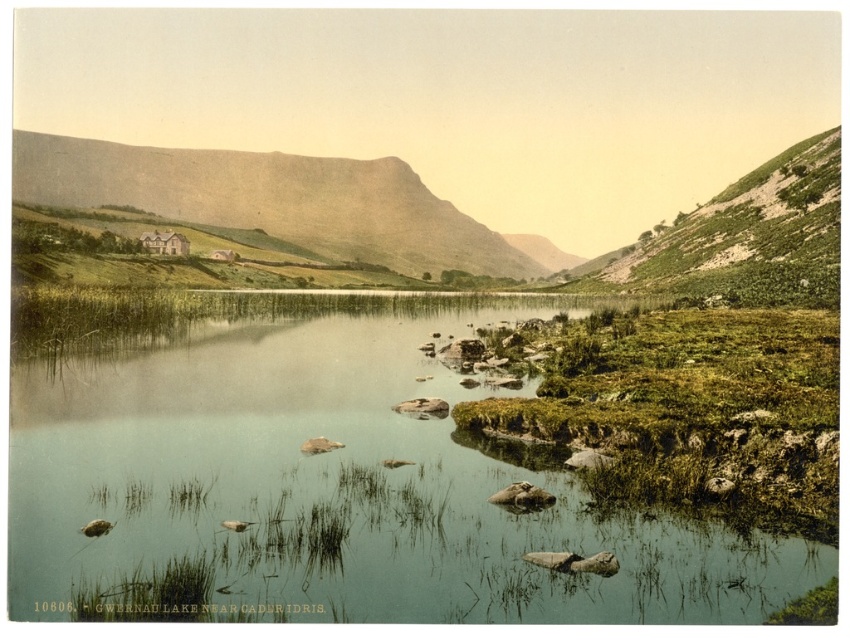
Question: Which of the following is the farthest from the observer?

Choices:
 (A) (673, 541)
 (B) (173, 177)

Answer: (B)

Question: Which of the following is the closest to the observer?

Choices:
 (A) green grassy river at center
 (B) smooth beige mountain at center

Answer: (A)

Question: Is green grassy river at center bigger than smooth beige mountain at center?

Choices:
 (A) no
 (B) yes

Answer: (A)

Question: In this image, where is green grassy river at center located relative to smooth beige mountain at center?

Choices:
 (A) left
 (B) right

Answer: (B)

Question: Which of the following is the farthest from the observer?

Choices:
 (A) (545, 241)
 (B) (309, 401)

Answer: (A)

Question: Can you confirm if green grassy river at center is smaller than smooth beige mountain at center?

Choices:
 (A) no
 (B) yes

Answer: (B)